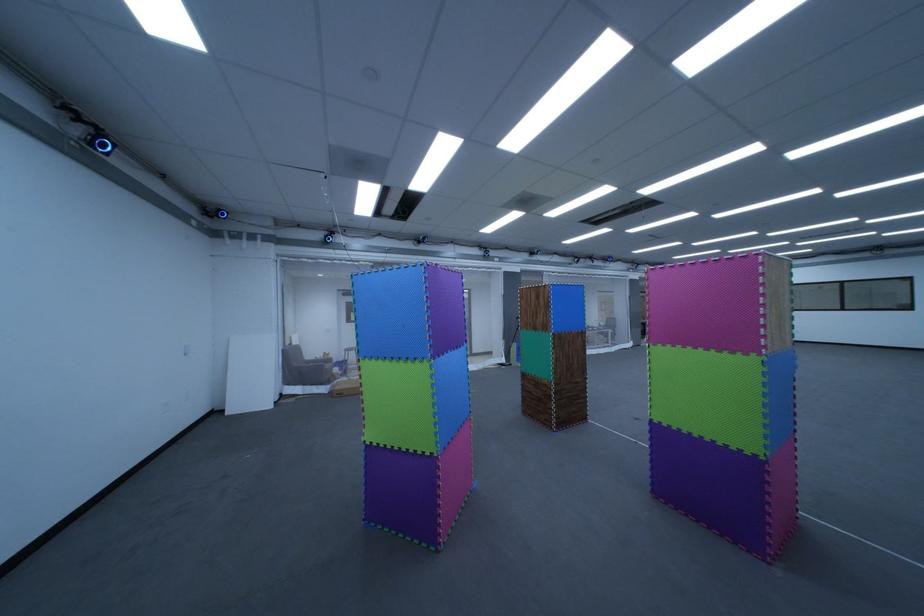
At what (x,y) coordinates should I click in order to perform the action: click on purple foam tile. Please return your answer as a coordinate pair (x, y). Image resolution: width=924 pixels, height=616 pixels. Looking at the image, I should click on (711, 485).